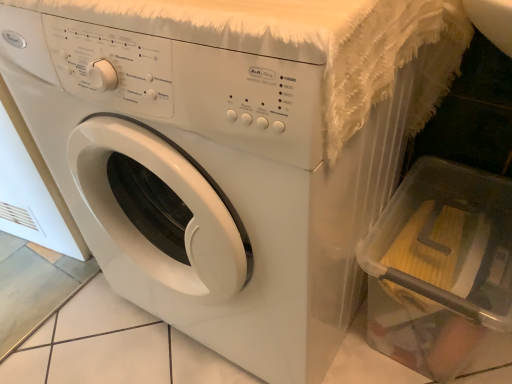
The height and width of the screenshot is (384, 512). Find the location of `transparent plastic dish washer at lower right`. transparent plastic dish washer at lower right is located at coordinates (442, 271).

Measure the distance between transparent plastic dish washer at lower right and camera.

transparent plastic dish washer at lower right is 69.98 centimeters away from camera.

What do you see at coordinates (442, 271) in the screenshot?
I see `transparent plastic dish washer at lower right` at bounding box center [442, 271].

Find the location of `transparent plastic dish washer at lower right`. transparent plastic dish washer at lower right is located at coordinates (442, 271).